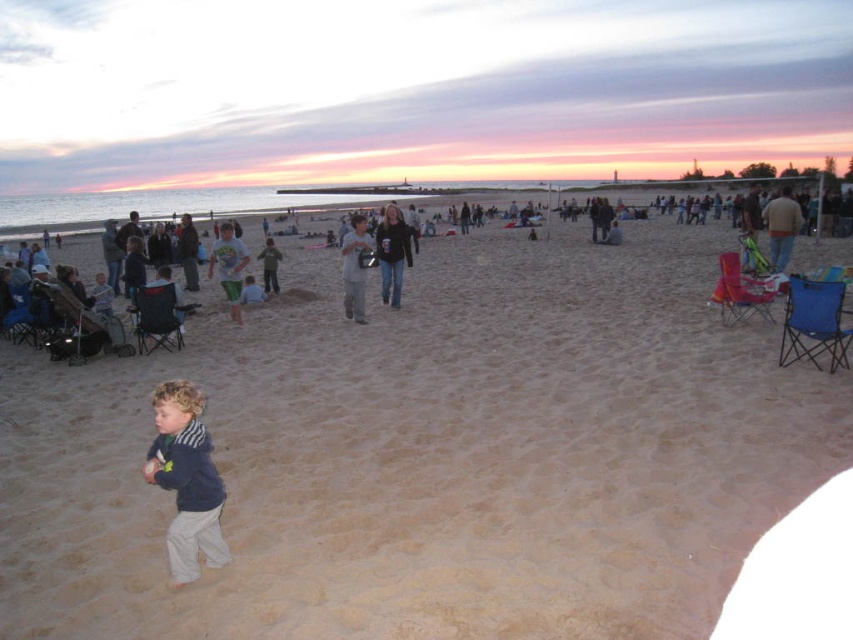
You are a photographer trying to capture the sunset scene. You notice two shirts at the center of the image. The light gray cotton shirt at center and the white cotton shirt at center. Which shirt is positioned to the right of the other?

The light gray cotton shirt at center is positioned to the right of the white cotton shirt at center.

You are a photographer at the beach scene. You need to decide which clothing item to focus on for a closeup shot. The dark blue fleece jacket at lower left and the white cotton shirt at center are both in view. Which one is smaller in size?

The dark blue fleece jacket at lower left has a smaller size compared to the white cotton shirt at center, so the photographer should focus on the dark blue fleece jacket at lower left for the closeup shot to capture its details clearly.